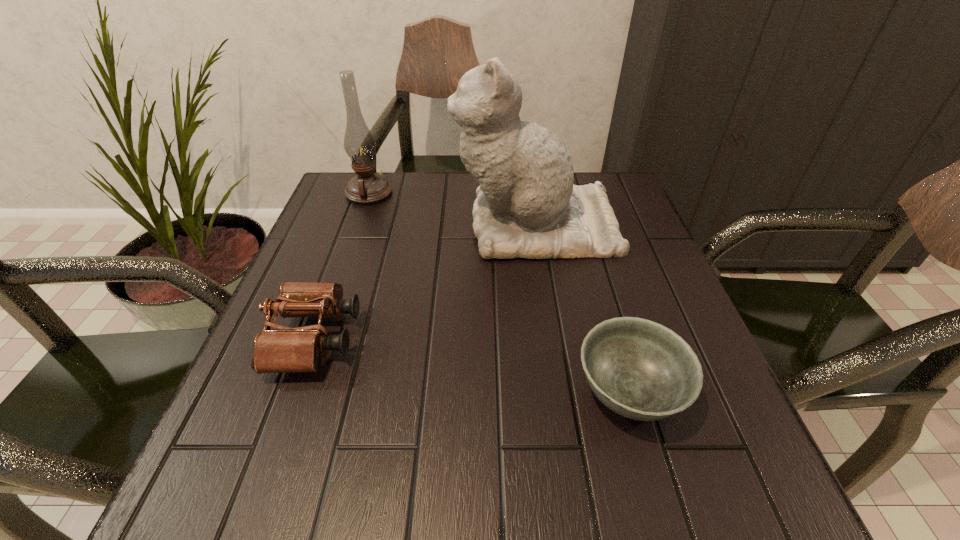
Find the location of a particular element. free space that satisfies the following two spatial constraints: 1. on the back side of the bowl; 2. through the eyepieces of the binoculars is located at coordinates (613, 339).

Identify the location of vacant area in the image that satisfies the following two spatial constraints: 1. through the eyepieces of the binoculars; 2. on the left side of the bowl. (296, 392).